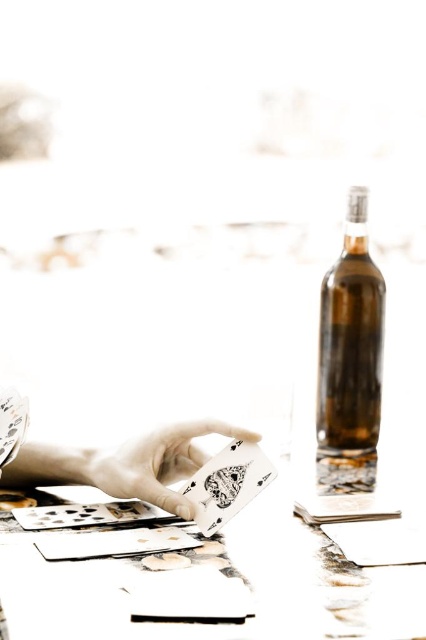
Question: Which object is positioned farthest from the white paper card at center?

Choices:
 (A) white paper table at center
 (B) brown glass bottle at right
 (C) white matte playing card at center

Answer: (B)

Question: Is white paper table at center to the right of brown glass bottle at right from the viewer's perspective?

Choices:
 (A) yes
 (B) no

Answer: (B)

Question: Can you confirm if brown glass bottle at right is positioned to the right of white matte playing card at center?

Choices:
 (A) yes
 (B) no

Answer: (A)

Question: Which point is closer to the camera?

Choices:
 (A) white matte playing card at center
 (B) white paper card at center

Answer: (B)

Question: Can you confirm if white matte playing card at center is wider than white paper card at center?

Choices:
 (A) no
 (B) yes

Answer: (B)

Question: Which object is closer to the camera taking this photo?

Choices:
 (A) white paper table at center
 (B) brown glass bottle at right
 (C) white paper card at center
 (D) white matte playing card at center

Answer: (A)